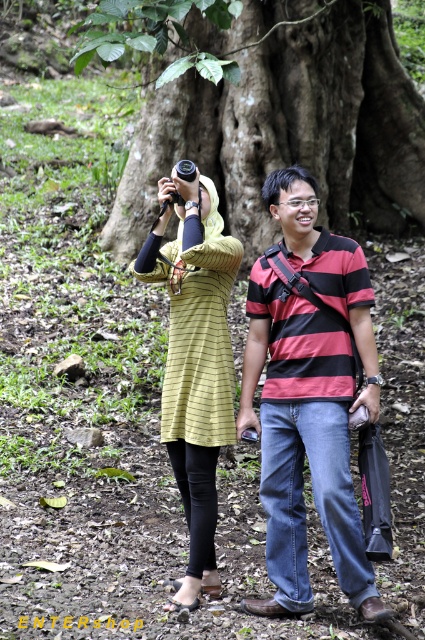
You are planning to take a photo of both the green rough bark tree at center and the striped cotton shirt at center. Based on their sizes, which one should you focus on first to ensure they both fit in the frame?

The green rough bark tree at center is larger in size than the striped cotton shirt at center, so you should focus on the green rough bark tree at center first to ensure both fit in the frame.

In the scene shown: You are a photographer trying to capture a landscape shot. You have a camera and need to decide whether the green rough bark tree at center will block the view of the yellow striped dress at upper left. Based on their heights, can you determine if the tree will obscure the dress in your photo?

The green rough bark tree at center is taller than the yellow striped dress at upper left, so it might block the view depending on their positions. However, since the dress is at upper left and the tree is at center, the tree could partially obscure the dress if they are aligned in the frame.